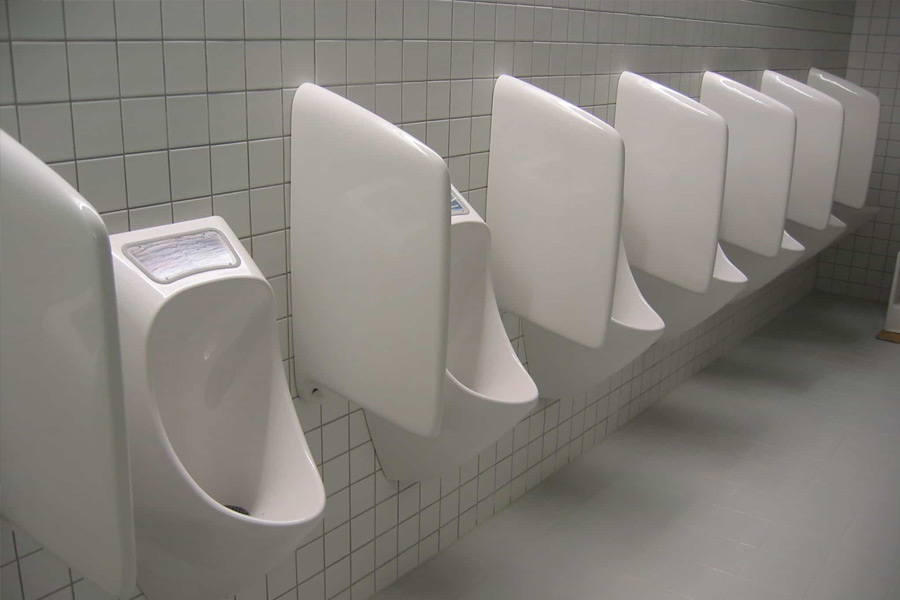
The height and width of the screenshot is (600, 900). Identify the location of urinal. coord(833,234), coord(797,250), coord(743,280), coord(610,335), coord(504,384), coord(212,498).